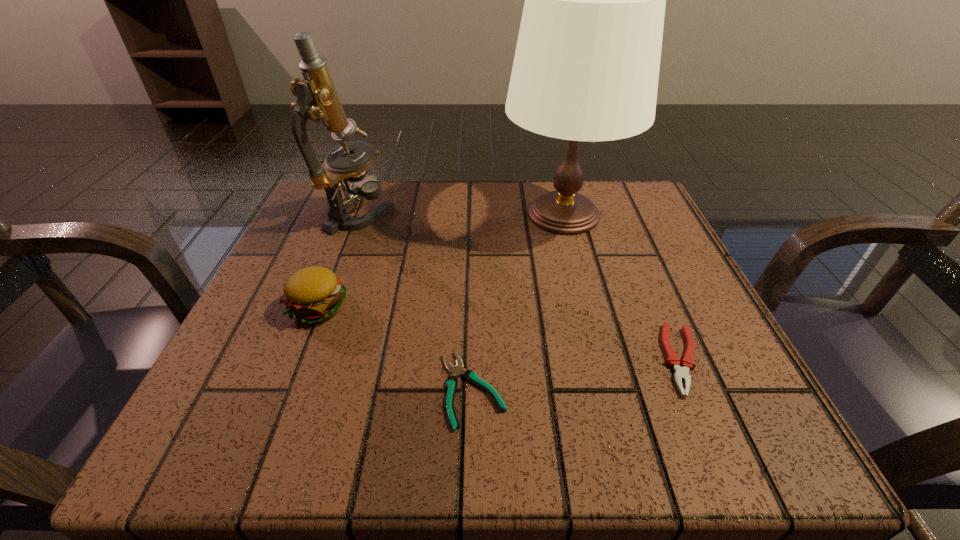
The height and width of the screenshot is (540, 960). What are the coordinates of `lamp` in the screenshot? It's located at (586, 67).

Where is `the second tallest object`? the second tallest object is located at coordinates (317, 99).

Where is `the third shortest object`? The image size is (960, 540). the third shortest object is located at coordinates (314, 294).

Locate an element on the screen. Image resolution: width=960 pixels, height=540 pixels. the right pliers is located at coordinates (681, 373).

Locate an element on the screen. This screenshot has width=960, height=540. the taller pliers is located at coordinates (681, 373).

Where is `the left pliers`? The image size is (960, 540). the left pliers is located at coordinates (471, 376).

Image resolution: width=960 pixels, height=540 pixels. In order to click on the shortest object in this screenshot , I will do `click(471, 376)`.

At what (x,y) coordinates should I click in order to perform the action: click on vacant space located 0.290m on the left of the lamp. Please return your answer as a coordinate pair (x, y). Looking at the image, I should click on (365, 215).

Identify the location of vacant space located on the front of the microscope. This screenshot has width=960, height=540. (340, 269).

Locate an element on the screen. This screenshot has width=960, height=540. free space located 0.220m on the back of the third shortest object is located at coordinates (353, 218).